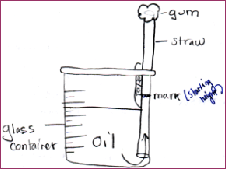
Image resolution: width=226 pixels, height=169 pixels. What are the coordinates of `glass container` in the screenshot? It's located at (64, 82).